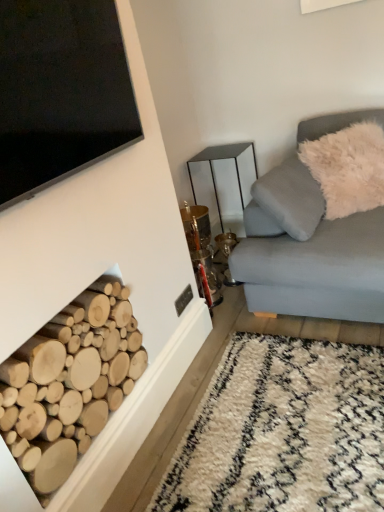
Question: Can you confirm if metallic mirrored table at center is wider than white shaggy rug at lower right?

Choices:
 (A) yes
 (B) no

Answer: (B)

Question: Considering the relative positions of metallic mirrored table at center and white shaggy rug at lower right in the image provided, is metallic mirrored table at center to the right of white shaggy rug at lower right from the viewer's perspective?

Choices:
 (A) yes
 (B) no

Answer: (B)

Question: Is metallic mirrored table at center surrounding white shaggy rug at lower right?

Choices:
 (A) no
 (B) yes

Answer: (A)

Question: Is metallic mirrored table at center in contact with white shaggy rug at lower right?

Choices:
 (A) no
 (B) yes

Answer: (A)

Question: Is metallic mirrored table at center thinner than white shaggy rug at lower right?

Choices:
 (A) yes
 (B) no

Answer: (A)

Question: Considering the relative sizes of metallic mirrored table at center and white shaggy rug at lower right in the image provided, is metallic mirrored table at center smaller than white shaggy rug at lower right?

Choices:
 (A) yes
 (B) no

Answer: (B)

Question: Is white shaggy rug at lower right at the right side of metallic mirrored table at center?

Choices:
 (A) yes
 (B) no

Answer: (A)

Question: Can you confirm if white shaggy rug at lower right is positioned to the left of metallic mirrored table at center?

Choices:
 (A) no
 (B) yes

Answer: (A)

Question: Is metallic mirrored table at center at the back of white shaggy rug at lower right?

Choices:
 (A) no
 (B) yes

Answer: (A)

Question: Can you confirm if white shaggy rug at lower right is bigger than metallic mirrored table at center?

Choices:
 (A) no
 (B) yes

Answer: (A)

Question: Is white shaggy rug at lower right wider than metallic mirrored table at center?

Choices:
 (A) no
 (B) yes

Answer: (B)

Question: Are white shaggy rug at lower right and metallic mirrored table at center located far from each other?

Choices:
 (A) yes
 (B) no

Answer: (A)

Question: Can you confirm if white shaggy rug at lower right is shorter than white fluffy pillow at upper right?

Choices:
 (A) no
 (B) yes

Answer: (B)